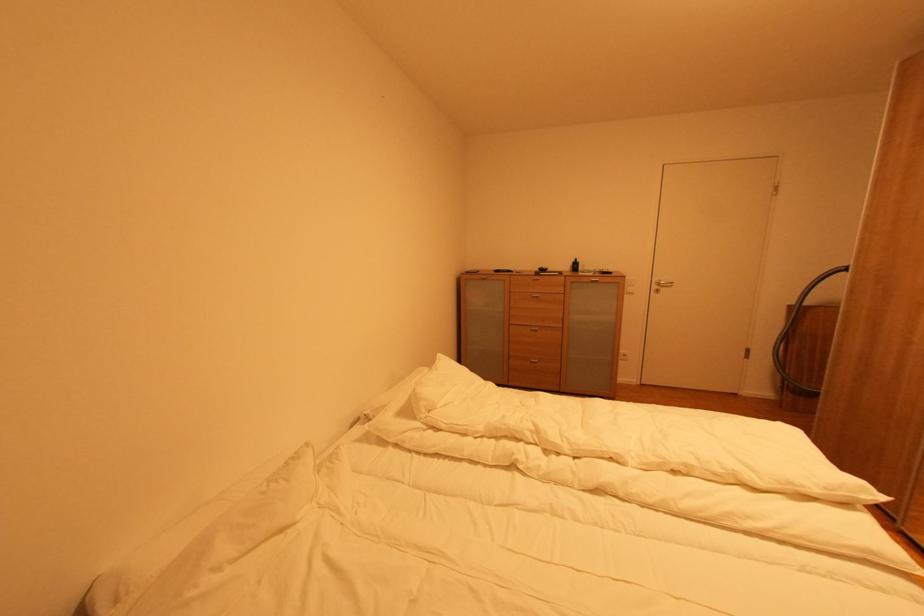
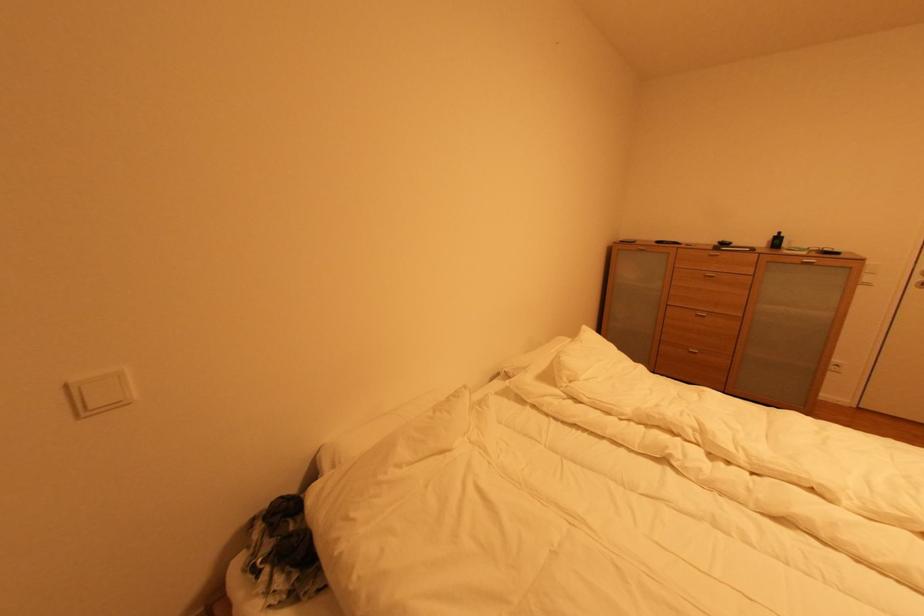
Question: Which direction would the cameraman need to move to produce the second image? Reply with the corresponding letter.

Choices:
 (A) Left
 (B) Right
 (C) Forward
 (D) Backward

Answer: (A)